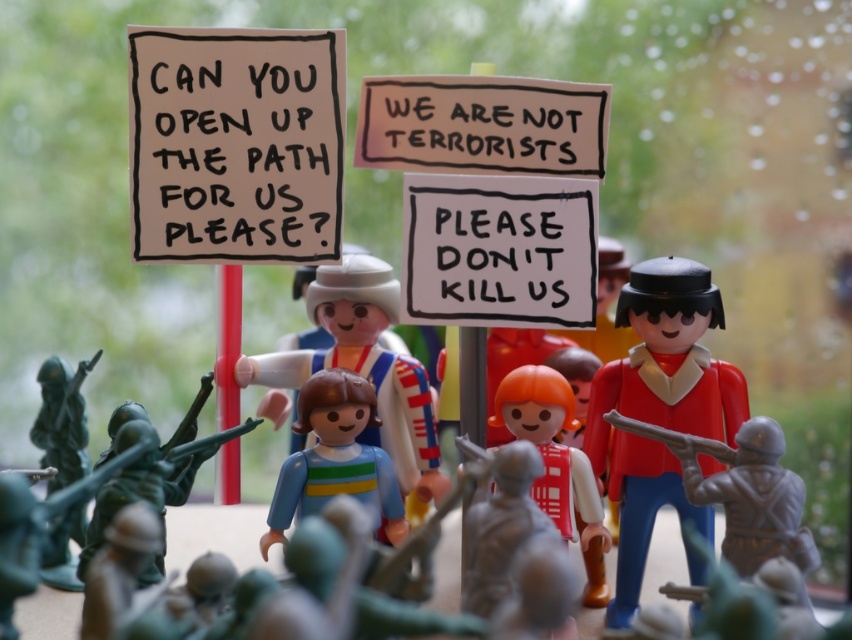
You are a protest organizer trying to ensure your signs are visible to the authorities. You have a white paper sign at upper left and a white plastic toy at center. Which object is larger and might be more noticeable from a distance?

The white plastic toy at center is larger than the white paper sign at upper left, making it more noticeable from a distance.

You are a protest organizer trying to arrange the signs and toys in the scene. Which object is positioned to the left of the other between the white paper sign at upper left and the white plastic toy at center?

The white paper sign at upper left is to the left of the white plastic toy at center according to the description.